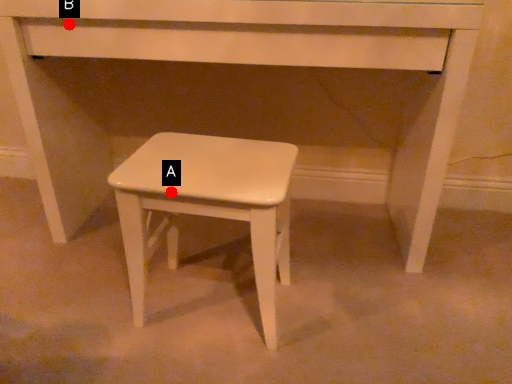
Question: Two points are circled on the image, labeled by A and B beside each circle. Which of the following is the closest to the observer?

Choices:
 (A) A is closer
 (B) B is closer

Answer: (A)